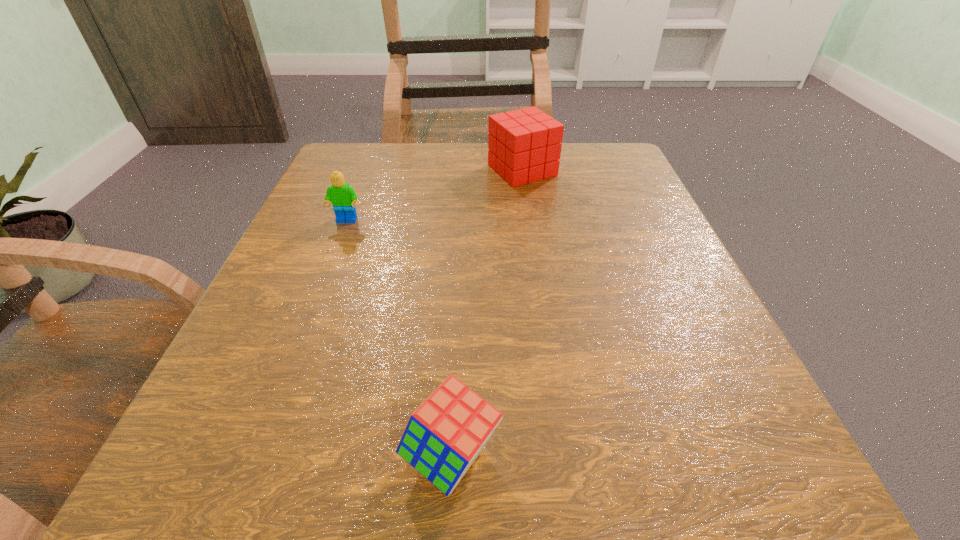
Find the location of `object that is the second closest to the nearer cube`. object that is the second closest to the nearer cube is located at coordinates (524, 145).

The image size is (960, 540). Find the location of `blank space that satisfies the following two spatial constraints: 1. on the face of the Lego; 2. on the left side of the nearest object`. blank space that satisfies the following two spatial constraints: 1. on the face of the Lego; 2. on the left side of the nearest object is located at coordinates (255, 456).

You are a GUI agent. You are given a task and a screenshot of the screen. Output one action in this format:
    pyautogui.click(x=<x>, y=<y>)
    Task: Click on the free spot that satisfies the following two spatial constraints: 1. on the face of the second nearest object; 2. on the right side of the nearer cube
    
    Given the screenshot: What is the action you would take?
    pyautogui.click(x=255, y=456)

The height and width of the screenshot is (540, 960). Find the location of `vacant point that satisfies the following two spatial constraints: 1. on the back side of the farthest object; 2. on the right side of the shorter cube`. vacant point that satisfies the following two spatial constraints: 1. on the back side of the farthest object; 2. on the right side of the shorter cube is located at coordinates (466, 170).